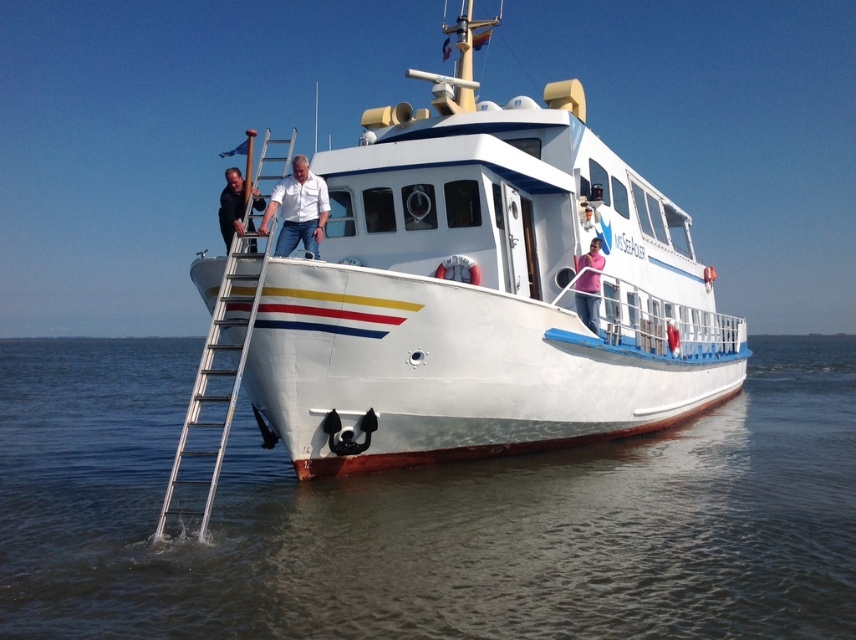
You are a passenger on the MS Seeholder and need to reach the pink fabric shirt at upper right. Which direction should you move from the silver metallic ladder at left to get there?

The silver metallic ladder at left is positioned on the left side of the pink fabric shirt at upper right, so you should move to the right from the silver metallic ladder at left to reach the pink fabric shirt at upper right.

You are a painter who needs to climb the ladder to reach the top of the boat. Considering the size of the silver metallic ladder at left and the white matte shirt at center, which object is more suitable for climbing?

The silver metallic ladder at left has a larger size compared to the white matte shirt at center, so the ladder is more suitable for climbing.